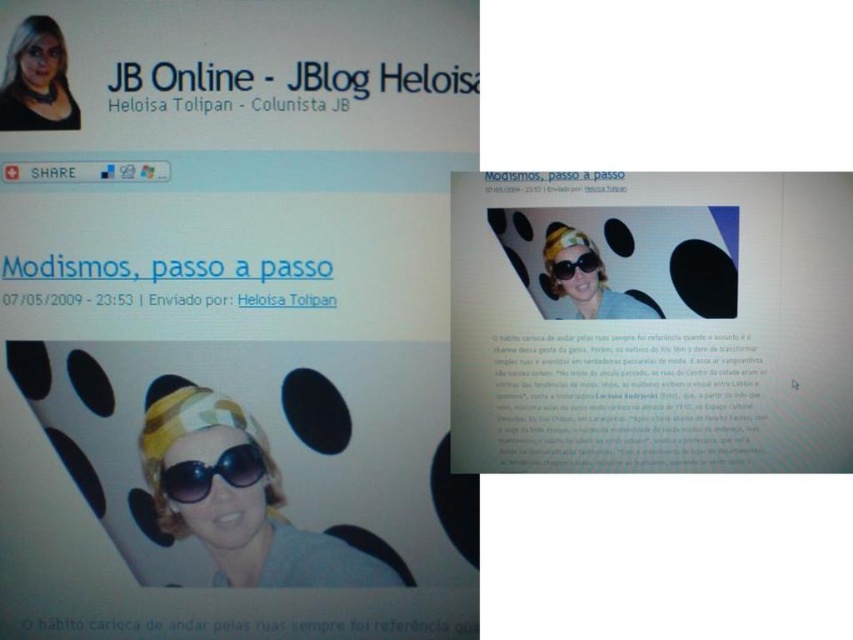
Question: Which object is positioned closest to the yellow fabric headband at center?

Choices:
 (A) matte black hair at upper left
 (B) matte black goggles at center
 (C) matte yellow goggles at center
 (D) matte yellow headband at center

Answer: (B)

Question: Is the position of yellow fabric headband at center more distant than that of matte black goggles at center?

Choices:
 (A) no
 (B) yes

Answer: (A)

Question: Is matte black hair at upper left closer to camera compared to matte yellow goggles at center?

Choices:
 (A) no
 (B) yes

Answer: (B)

Question: Which object is closer to the camera taking this photo?

Choices:
 (A) matte yellow goggles at center
 (B) matte black goggles at center

Answer: (A)

Question: Among these points, which one is nearest to the camera?

Choices:
 (A) (6, 96)
 (B) (189, 464)

Answer: (A)

Question: Can you confirm if yellow fabric headband at center is smaller than matte yellow headband at center?

Choices:
 (A) no
 (B) yes

Answer: (A)